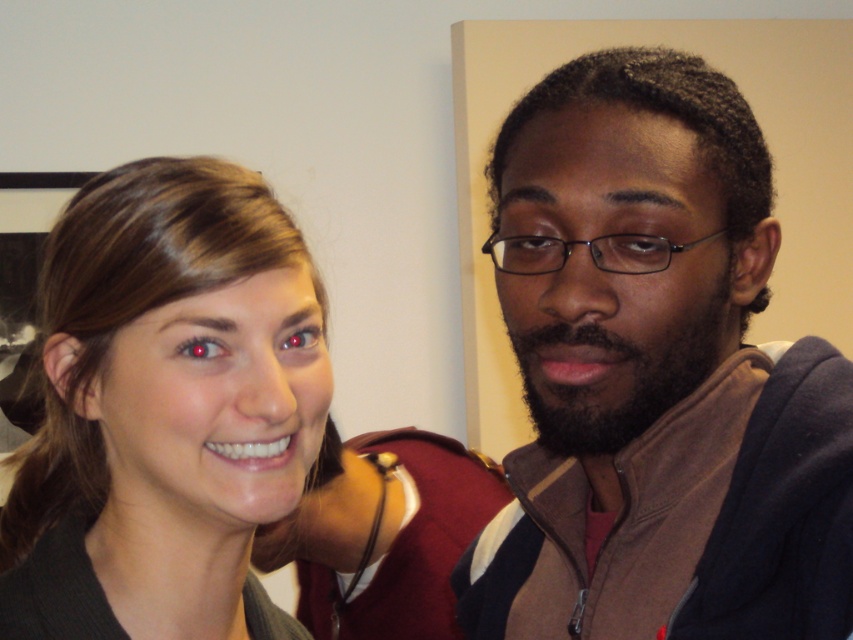
Between brown fleece jacket at right and smooth skin face at center, which one has less height?

With less height is smooth skin face at center.

Who is higher up, brown fleece jacket at right or smooth skin face at center?

brown fleece jacket at right is higher up.

Does point (468, 605) lie in front of point (300, 390)?

No.

Identify the location of brown fleece jacket at right. (656, 374).